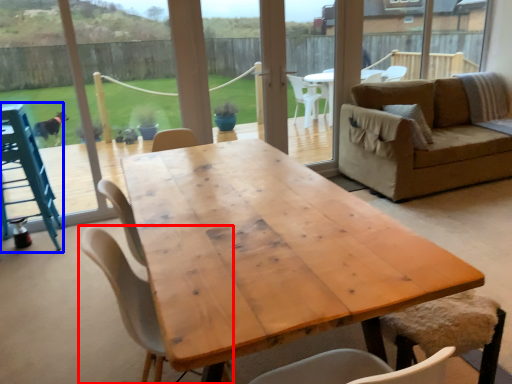
Question: Which point is further to the camera, chair (highlighted by a red box) or feeding chair (highlighted by a blue box)?

Choices:
 (A) chair
 (B) feeding chair

Answer: (B)